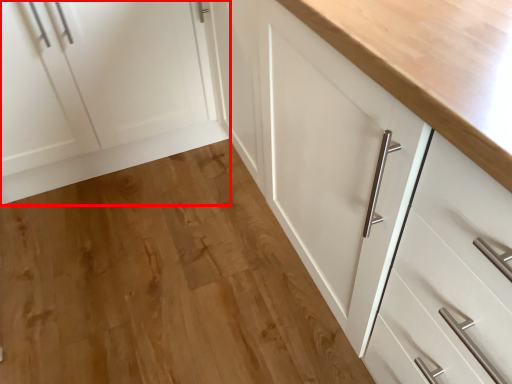
Question: From the image, what is the correct spatial relationship of cabinetry (annotated by the red box) in relation to hardwood?

Choices:
 (A) left
 (B) right

Answer: (A)